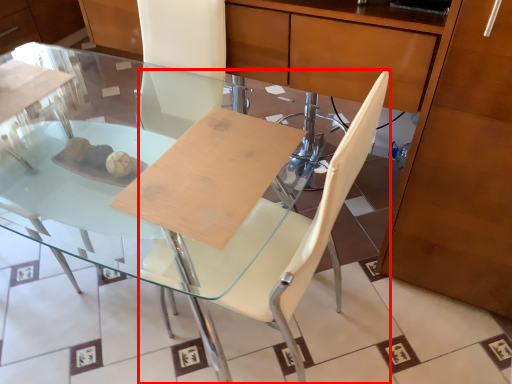
Question: Observing the image, what is the correct spatial positioning of chair (annotated by the red box) in reference to table?

Choices:
 (A) left
 (B) right

Answer: (B)